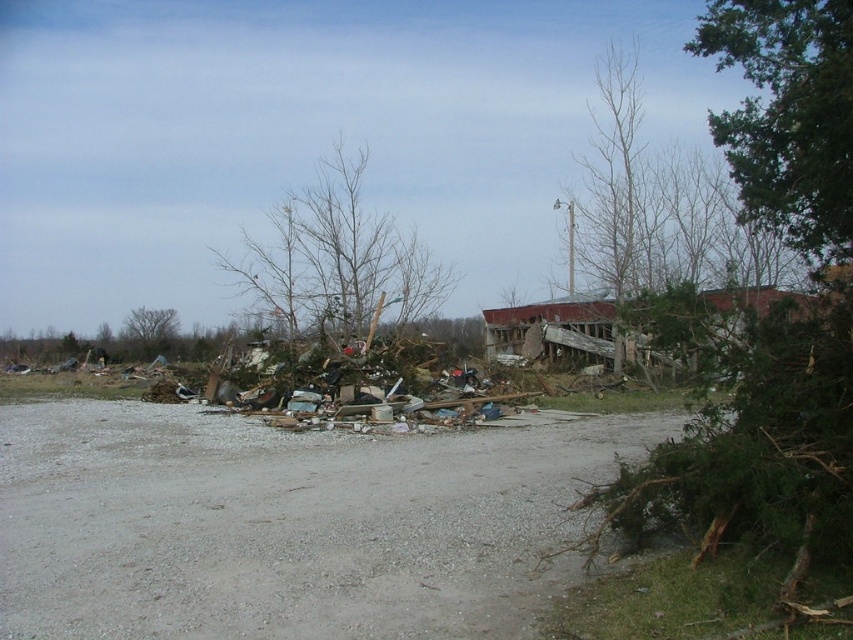
Question: Which object is positioned closest to the bare wood tree at center?

Choices:
 (A) green leafy tree at upper left
 (B) green leafy tree at upper right

Answer: (A)

Question: Can you confirm if green leafy tree at upper right is positioned above bare wood tree at center?

Choices:
 (A) no
 (B) yes

Answer: (B)

Question: Is green leafy tree at upper right thinner than bare wood tree at center?

Choices:
 (A) no
 (B) yes

Answer: (B)

Question: Can you confirm if green leafy tree at upper right is thinner than green leafy tree at upper left?

Choices:
 (A) no
 (B) yes

Answer: (A)

Question: Which object is farther from the camera taking this photo?

Choices:
 (A) bare wood tree at center
 (B) green leafy tree at upper left
 (C) green leafy tree at upper right

Answer: (B)

Question: Which point is closer to the camera taking this photo?

Choices:
 (A) (154, 340)
 (B) (372, 300)

Answer: (B)